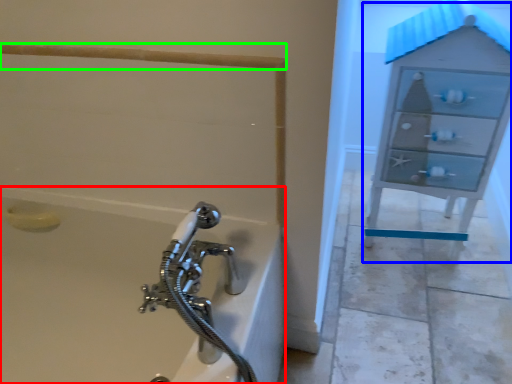
Question: Which is farther away from bathtub (highlighted by a red box)? file cabinet (highlighted by a blue box) or rail (highlighted by a green box)?

Choices:
 (A) file cabinet
 (B) rail

Answer: (A)